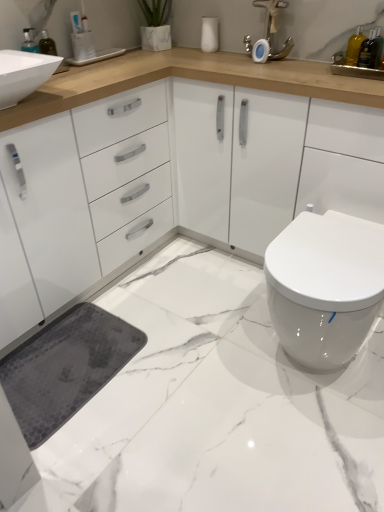
Locate an element on the screen. This screenshot has height=512, width=384. vacant space situated on the left part of translucent glass bottle at upper right, the 2th sink from the left is located at coordinates (316, 67).